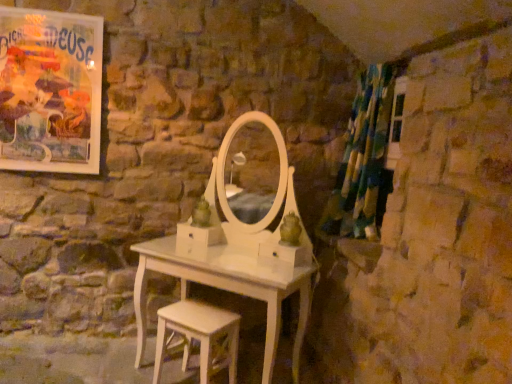
Identify the location of empty space that is ontop of white wood stool at lower center (from a real-world perspective). This screenshot has width=512, height=384. (204, 322).